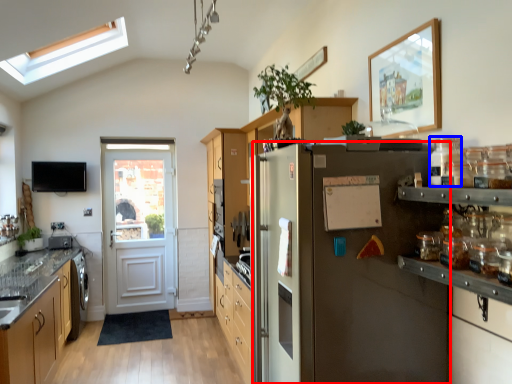
Question: Which point is closer to the camera, refrigerator (highlighted by a red box) or glass jar (highlighted by a blue box)?

Choices:
 (A) refrigerator
 (B) glass jar

Answer: (B)